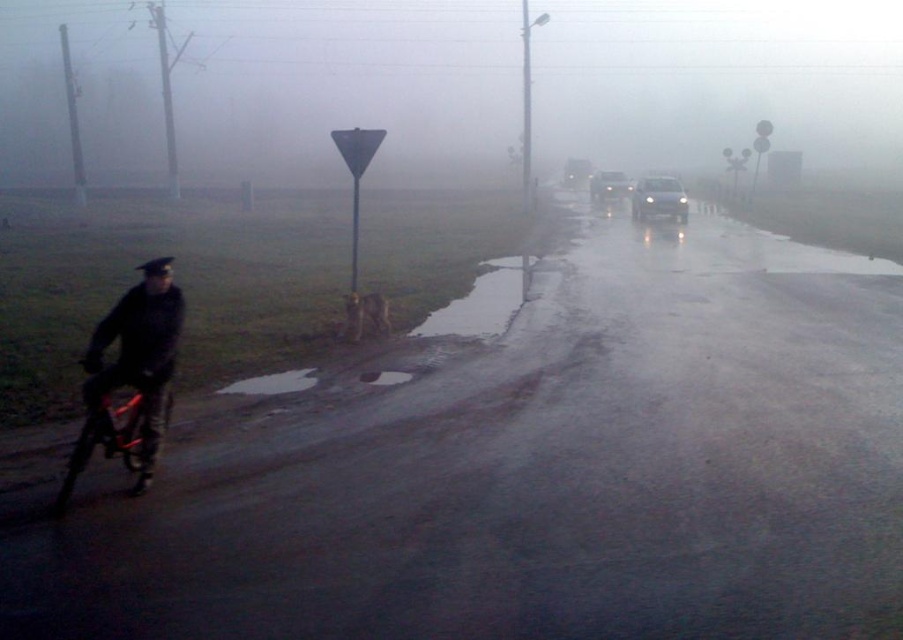
Question: Is matte black jacket at left bigger than shiny metallic bicycle at left?

Choices:
 (A) yes
 (B) no

Answer: (B)

Question: Does shiny metallic bicycle at left appear under shiny silver sedan at center right?

Choices:
 (A) no
 (B) yes

Answer: (B)

Question: Among these points, which one is nearest to the camera?

Choices:
 (A) (638, 186)
 (B) (131, 371)
 (C) (165, 394)

Answer: (B)

Question: Which of these objects is positioned farthest from the shiny metallic bicycle at left?

Choices:
 (A) white glossy sedan at center-right
 (B) matte black jacket at left

Answer: (A)

Question: Which point is farther to the camera?

Choices:
 (A) (678, 180)
 (B) (622, 173)
 (C) (109, 369)

Answer: (B)

Question: Can you confirm if shiny metallic bicycle at left is bigger than white glossy sedan at center-right?

Choices:
 (A) yes
 (B) no

Answer: (B)